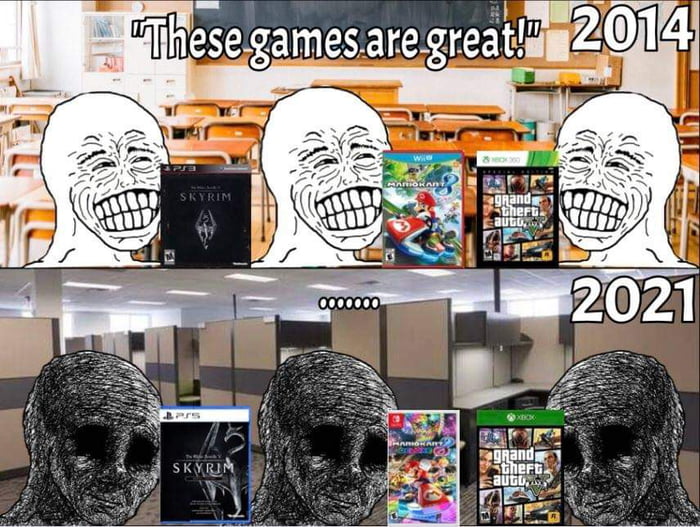
Where is `workspace`? The height and width of the screenshot is (527, 700). workspace is located at coordinates (523, 393), (295, 352), (192, 374), (141, 360).